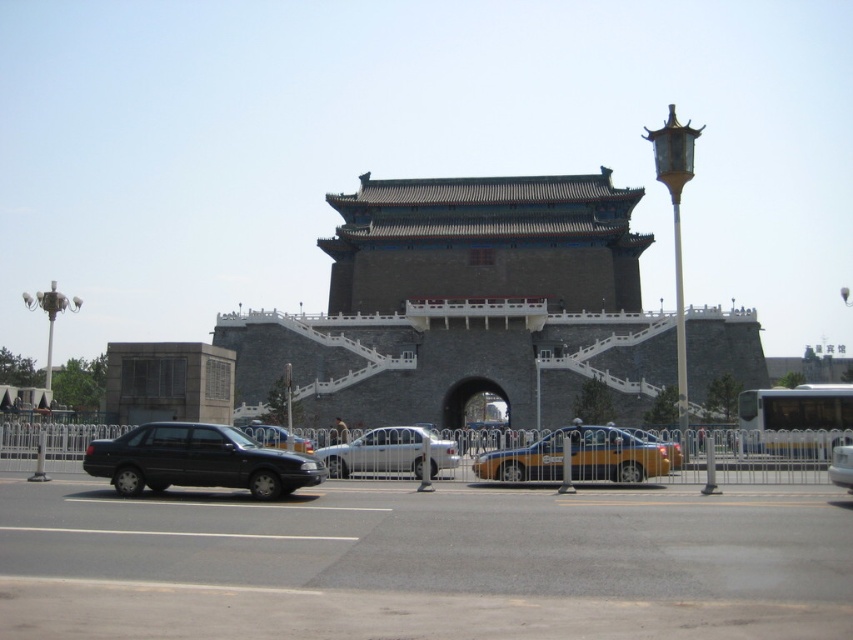
Question: Which of these objects is positioned closest to the matte black sedan at left?

Choices:
 (A) yellow matte taxi at center
 (B) brown stone tower at center
 (C) shiny black sedan at center

Answer: (C)

Question: Can you confirm if shiny black sedan at center is bigger than metallic silver car at center?

Choices:
 (A) yes
 (B) no

Answer: (A)

Question: Can you confirm if matte black sedan at left is positioned to the left of shiny black sedan at center?

Choices:
 (A) yes
 (B) no

Answer: (B)

Question: Does matte black sedan at left have a smaller size compared to shiny black sedan at center?

Choices:
 (A) no
 (B) yes

Answer: (B)

Question: Among these points, which one is farthest from the camera?

Choices:
 (A) (844, 445)
 (B) (543, 449)

Answer: (A)

Question: Which point is farther from the camera taking this photo?

Choices:
 (A) (221, 326)
 (B) (625, 436)
 (C) (247, 426)

Answer: (A)